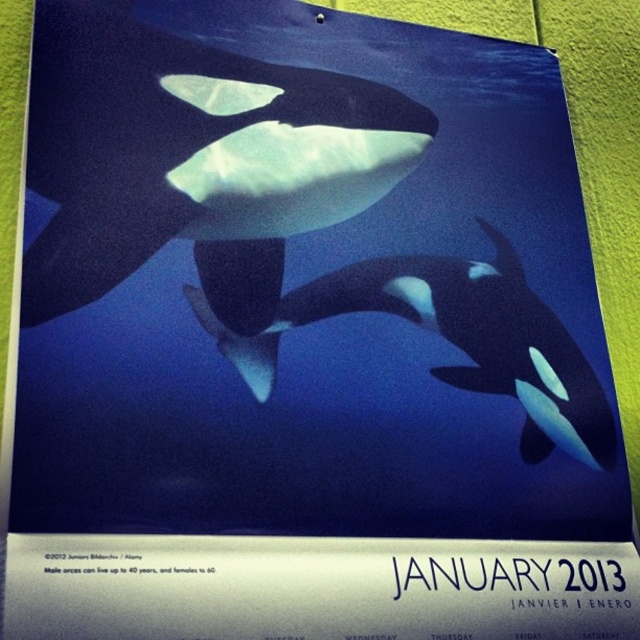
Question: Is matte black whale at center positioned in front of black matte/soft whale at center?

Choices:
 (A) yes
 (B) no

Answer: (A)

Question: Does matte black whale at center have a smaller size compared to black matte/soft whale at center?

Choices:
 (A) no
 (B) yes

Answer: (A)

Question: From the image, what is the correct spatial relationship of matte black whale at center in relation to black matte/soft whale at center?

Choices:
 (A) above
 (B) below

Answer: (A)